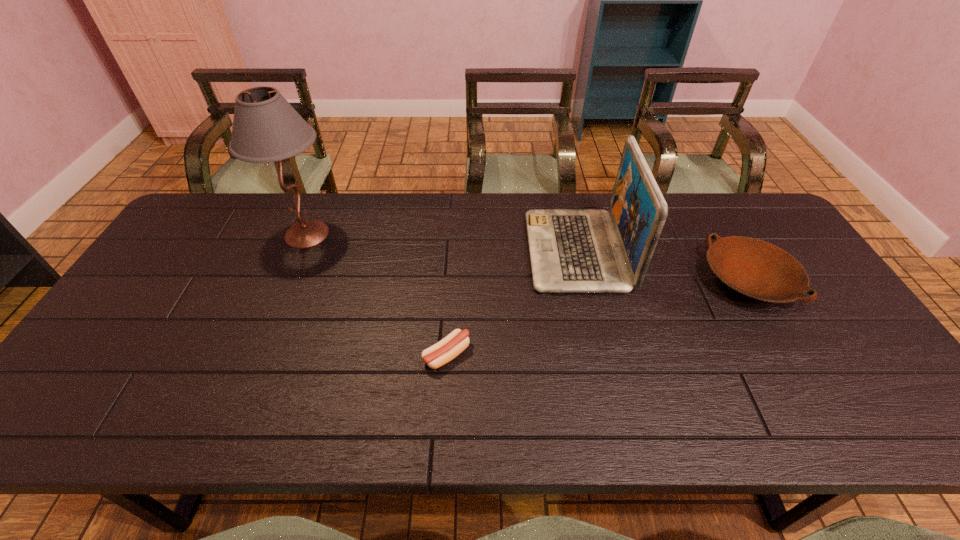
Locate an element on the screen. This screenshot has height=540, width=960. empty space that is in between the rightmost object and the second object from right to left is located at coordinates (662, 265).

The image size is (960, 540). I want to click on vacant region between the sausage and the table lamp, so click(376, 295).

Identify which object is located as the nearest to the tallest object. Please provide its 2D coordinates. Your answer should be formatted as a tuple, i.e. [(x, y)], where the tuple contains the x and y coordinates of a point satisfying the conditions above.

[(437, 355)]

Find the location of `object that ranks as the closest to the third object from left to right`. object that ranks as the closest to the third object from left to right is located at coordinates (757, 269).

Locate an element on the screen. This screenshot has width=960, height=540. vacant space that satisfies the following two spatial constraints: 1. on the screen of the second tallest object; 2. on the left side of the plate is located at coordinates (584, 280).

In order to click on vacant space that satisfies the following two spatial constraints: 1. on the screen of the plate; 2. on the right side of the third object from left to right in this screenshot , I will do `click(584, 280)`.

This screenshot has width=960, height=540. What are the coordinates of `vacant point that satisfies the following two spatial constraints: 1. on the front-facing side of the table lamp; 2. on the back side of the rightmost object` in the screenshot? It's located at pyautogui.click(x=288, y=280).

This screenshot has height=540, width=960. Identify the location of free space that satisfies the following two spatial constraints: 1. on the front-facing side of the leftmost object; 2. on the back side of the second object from left to right. (256, 355).

Find the location of a particular element. free location that satisfies the following two spatial constraints: 1. on the front-facing side of the table lamp; 2. on the left side of the plate is located at coordinates tap(288, 280).

What are the coordinates of `free point that satisfies the following two spatial constraints: 1. on the back side of the sausage; 2. on the front-facing side of the table lamp` in the screenshot? It's located at (454, 234).